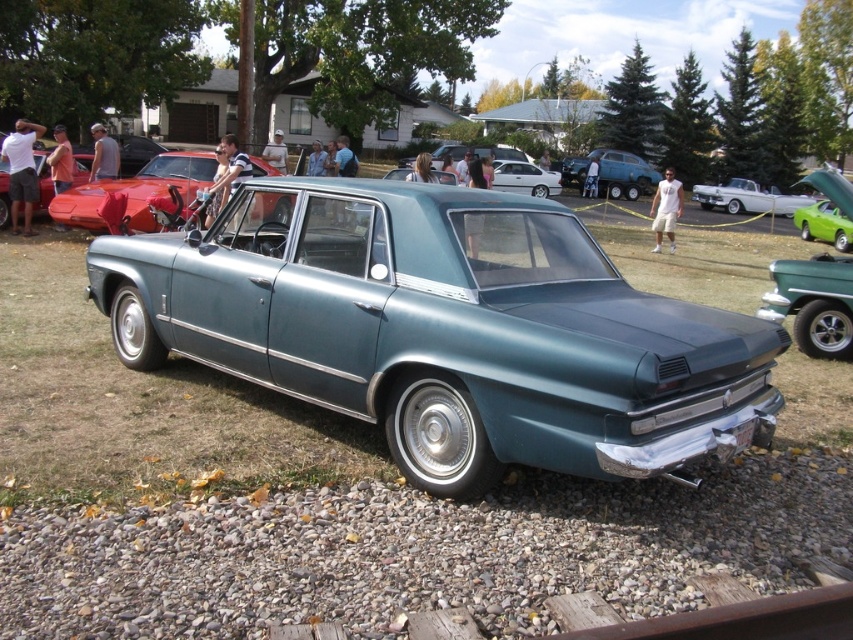
You are a photographer trying to capture a photo of both the metallic teal sedan at center and the metallic green car at center. Since you want them both in the frame, which direction should you move to ensure both cars are visible?

The metallic teal sedan at center is positioned on the left side of the metallic green car at center. To include both in your photo, you should move to the right side of the metallic green car at center so that both cars are within the frame.

From the picture: You are at a car show and want to take a photo of the metallic green car at center and the teal metallic sedan at center. Since you have a camera with a fixed focal length, you need to know which one is larger to frame your shot properly. Which car should you focus on first to ensure it fits in the frame?

The metallic green car at center is bigger than the teal metallic sedan at center, so you should focus on the metallic green car at center first to ensure it fits in the frame.

You are a photographer trying to capture a photo of the shiny red car at center and the white glossy convertible at upper right. You want to ensure both cars are visible in the frame. Based on their positions, which car should you position your camera closer to in order to include both in the shot?

Since the shiny red car at center is to the left of the white glossy convertible at upper right, you should position your camera closer to the shiny red car at center to include both in the shot.